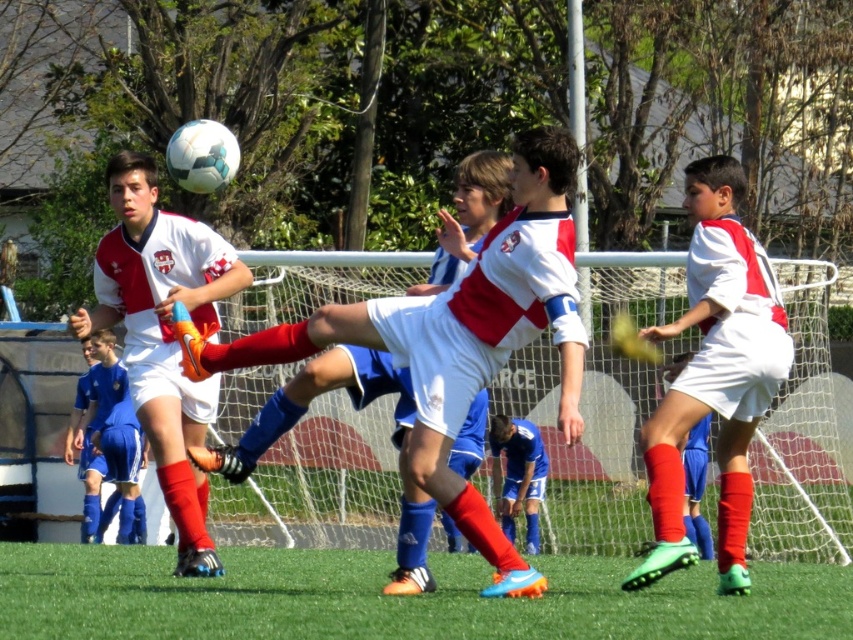
Question: Is green turf at center bigger than blue matte soccer player at lower center?

Choices:
 (A) no
 (B) yes

Answer: (A)

Question: Does matte white soccer ball at upper center have a greater width compared to blue matte soccer player at lower center?

Choices:
 (A) no
 (B) yes

Answer: (B)

Question: Which point appears closest to the camera in this image?

Choices:
 (A) (515, 508)
 (B) (277, 609)

Answer: (B)

Question: Which of the following is the closest to the observer?

Choices:
 (A) white matte shorts at center
 (B) matte white soccer ball at center
 (C) matte white soccer ball at upper center

Answer: (B)

Question: Is green turf at center below matte white soccer ball at upper center?

Choices:
 (A) no
 (B) yes

Answer: (B)

Question: Which of the following is the farthest from the observer?

Choices:
 (A) (524, 464)
 (B) (722, 636)

Answer: (A)